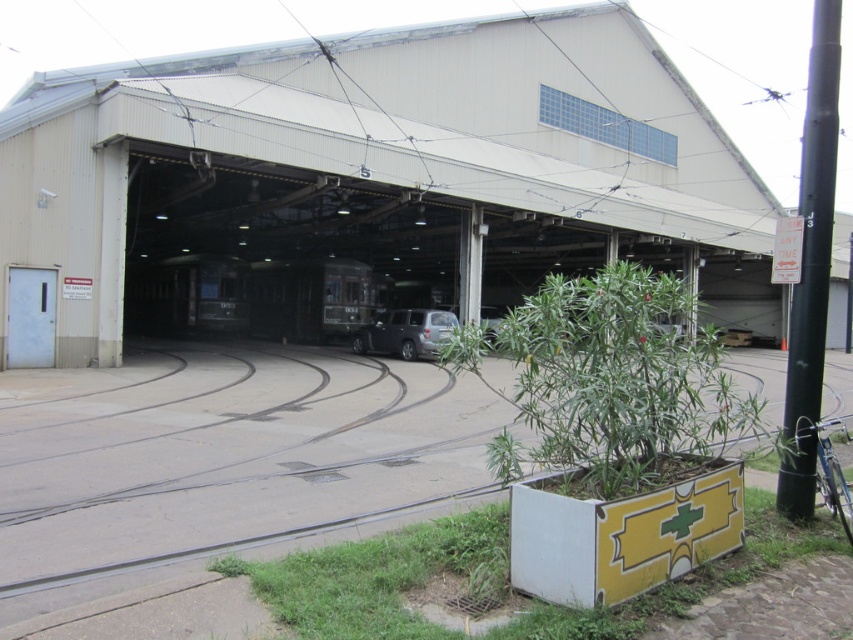
Is black metal pole at right behind satin black suv at center?

No.

Is black metal pole at right closer to the viewer compared to satin black suv at center?

Yes, it is.

Describe the element at coordinates (811, 266) in the screenshot. I see `black metal pole at right` at that location.

Where is `black metal pole at right`? black metal pole at right is located at coordinates (811, 266).